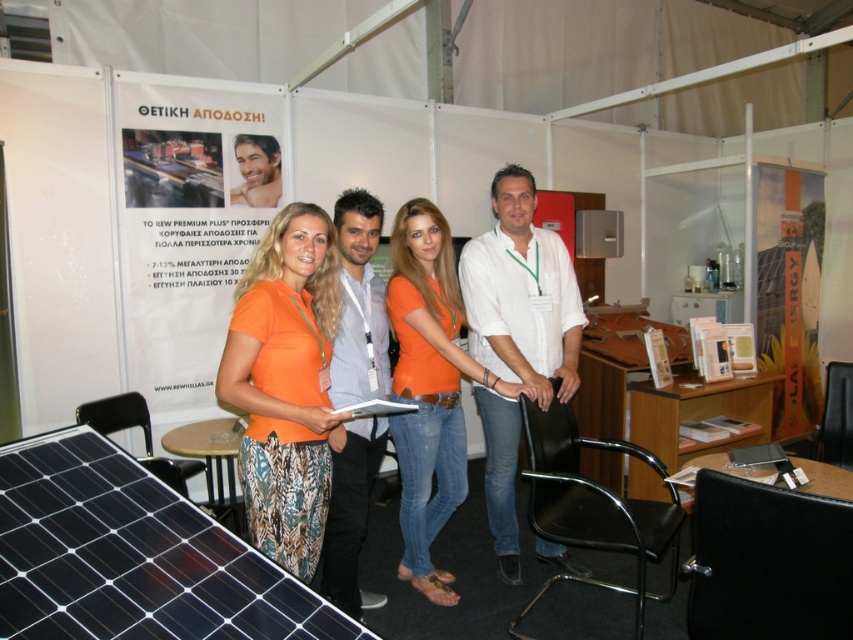
You are standing at the trade show booth and want to move from point A to point B. Point A is at coordinate point (451, 385) and point B is at coordinate point (384, 400). Which point is closer to you when you are facing the solar panel?

Point A at coordinate point (451, 385) is closer to you because it is further to the viewer than point B at coordinate point (384, 400).